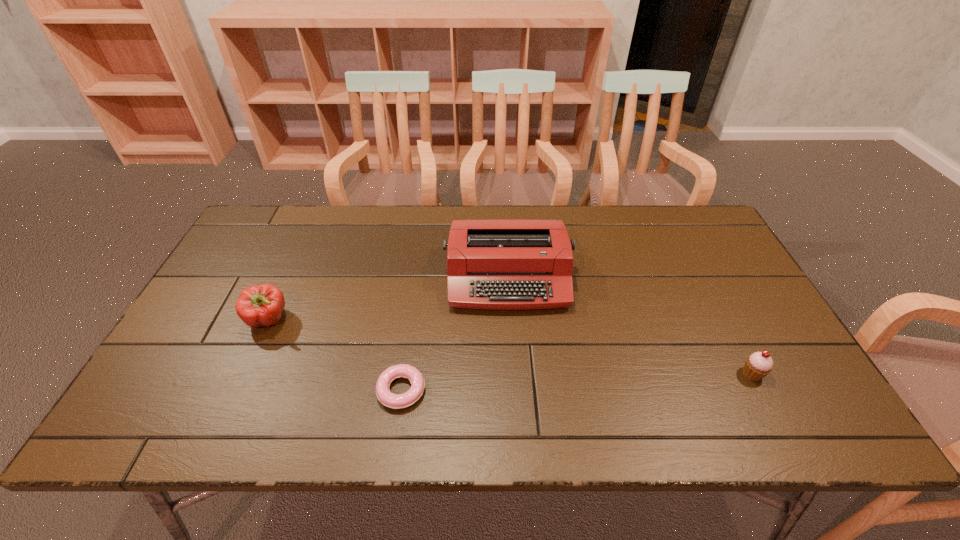
This screenshot has width=960, height=540. Identify the location of free space between the third tallest object and the second object from left to right. (577, 382).

Identify the location of free space between the bell pepper and the rightmost object. Image resolution: width=960 pixels, height=540 pixels. (511, 347).

You are a GUI agent. You are given a task and a screenshot of the screen. Output one action in this format:
    pyautogui.click(x=<x>, y=<y>)
    Task: Click on the vacant area that lies between the second shortest object and the bell pepper
    The height and width of the screenshot is (540, 960).
    Given the screenshot: What is the action you would take?
    pyautogui.click(x=511, y=347)

The height and width of the screenshot is (540, 960). What are the coordinates of `vacant area that lies between the typewriter and the bell pepper` in the screenshot? It's located at (389, 299).

Locate an element on the screen. vacant area that lies between the cupcake and the second object from right to left is located at coordinates (630, 326).

Locate an element on the screen. blank region between the cupcake and the typewriter is located at coordinates (630, 326).

The height and width of the screenshot is (540, 960). In order to click on vacant region between the leftmost object and the rightmost object in this screenshot , I will do `click(511, 347)`.

I want to click on empty location between the shortest object and the leftmost object, so click(x=335, y=355).

The width and height of the screenshot is (960, 540). Identify the location of free point between the doughnut and the bell pepper. (335, 355).

The width and height of the screenshot is (960, 540). I want to click on object that is the second closest to the third object from left to right, so 758,365.